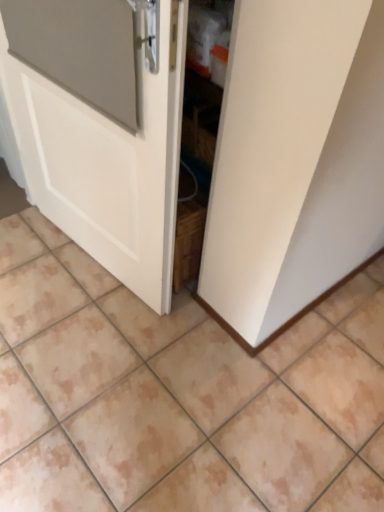
Question: In terms of height, does white matte door at center look taller or shorter compared to beige ceramic tile at center?

Choices:
 (A) tall
 (B) short

Answer: (A)

Question: From the image's perspective, is white matte door at center positioned above or below beige ceramic tile at center?

Choices:
 (A) below
 (B) above

Answer: (B)

Question: From a real-world perspective, relative to beige ceramic tile at center, is white matte door at center vertically above or below?

Choices:
 (A) below
 (B) above

Answer: (B)

Question: Is beige ceramic tile at center taller or shorter than white matte door at center?

Choices:
 (A) short
 (B) tall

Answer: (A)

Question: From the image's perspective, is beige ceramic tile at center located above or below white matte door at center?

Choices:
 (A) below
 (B) above

Answer: (A)

Question: Is point (54, 355) closer or farther from the camera than point (33, 197)?

Choices:
 (A) farther
 (B) closer

Answer: (B)

Question: In terms of size, does beige ceramic tile at center appear bigger or smaller than white matte door at center?

Choices:
 (A) big
 (B) small

Answer: (A)